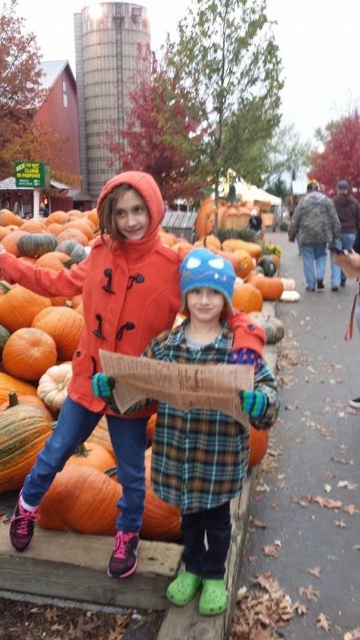
Is point (135, 339) farther from viewer compared to point (239, 458)?

Yes, point (135, 339) is farther from viewer.

Is matte orange coat at center shorter than plaid fabric coat at center?

No, matte orange coat at center is not shorter than plaid fabric coat at center.

Identify the location of matte orange coat at center. This screenshot has width=360, height=640. (105, 348).

Locate an element on the screen. The image size is (360, 640). matte orange coat at center is located at coordinates (105, 348).